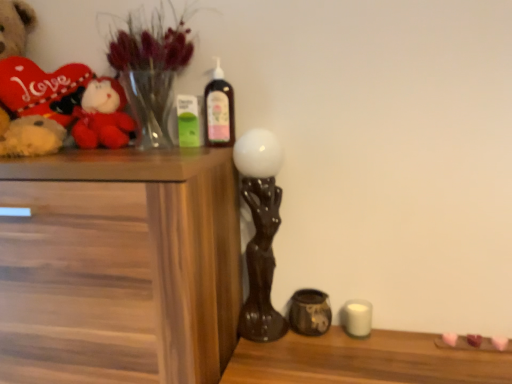
The height and width of the screenshot is (384, 512). In order to click on free region under translucent glass vase at upper left (from a real-world perspective) in this screenshot , I will do `click(153, 150)`.